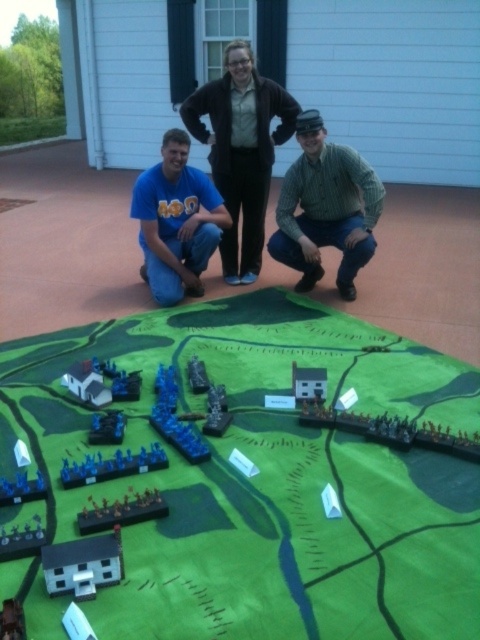
You are organizing a miniature diorama and need to place two groups of blue plastic soldiers. The blue plastic soldiers at lower center and the blue plastic toy soldiers at lower left must be positioned such that there is enough space between them for a small vehicle to pass through. The vehicle requires a minimum of 20 centimeters of space. Can the current spacing between the two groups of soldiers accommodate this requirement?

The blue plastic soldiers at lower center is 21.06 centimeters from blue plastic toy soldiers at lower left, which is more than the required 20 centimeters. Therefore, the current spacing can accommodate the small vehicle passing through.